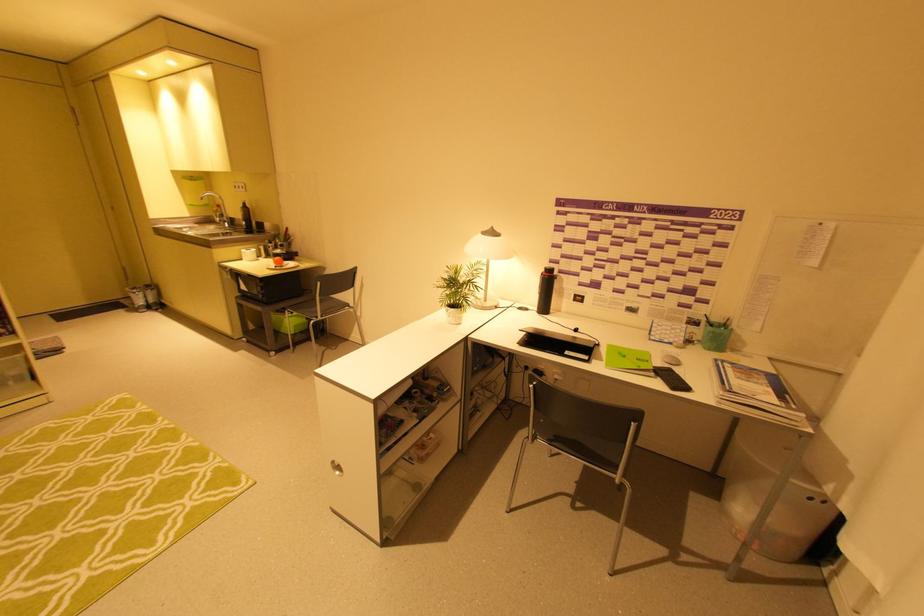
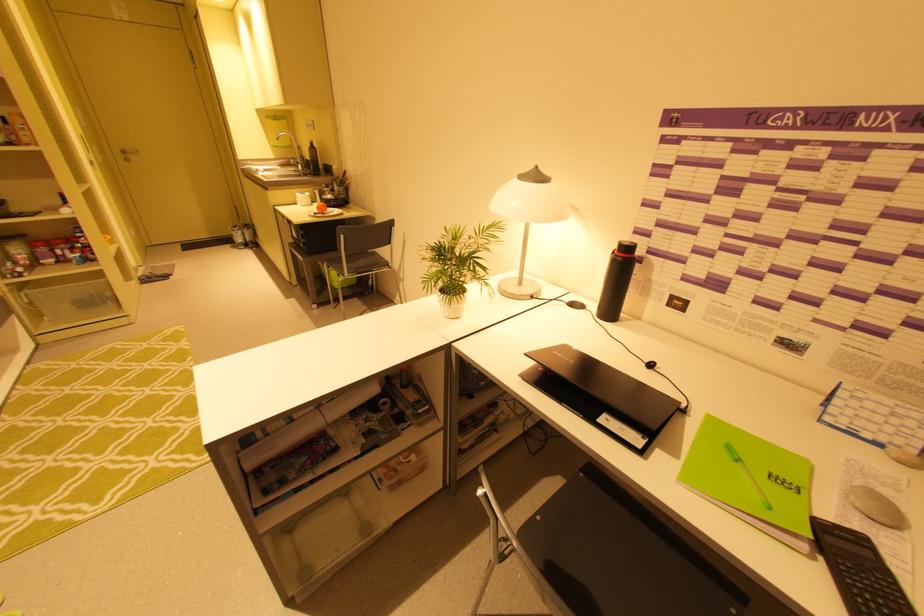
Find the pixel in the second image that matches point 262,257 in the first image.

(317, 203)